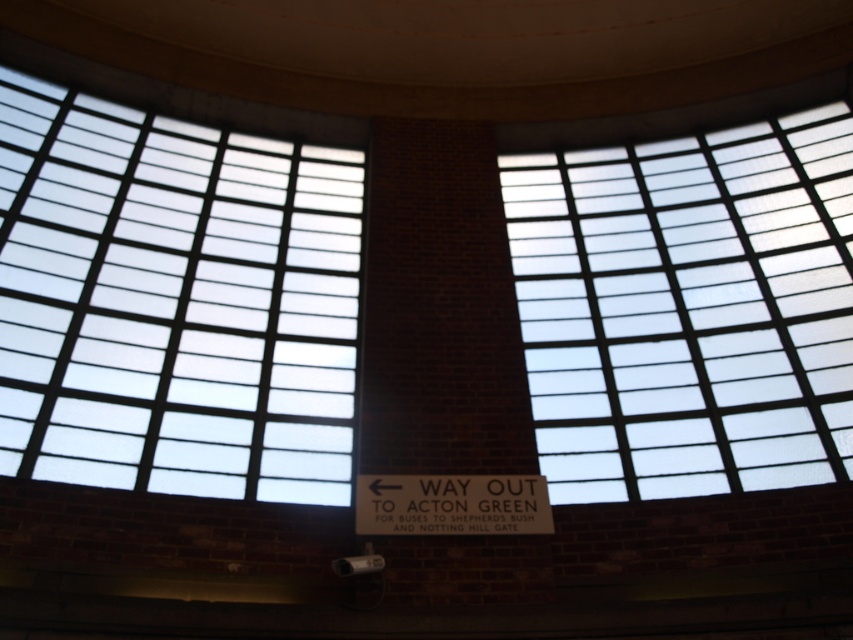
Which of these two, clear glass window at upper left or clear glass window at upper right, stands taller?

Standing taller between the two is clear glass window at upper left.

Is clear glass window at upper left wider than clear glass window at upper right?

Correct, the width of clear glass window at upper left exceeds that of clear glass window at upper right.

Is point (196, 371) closer to viewer compared to point (755, 200)?

That is True.

Identify the location of clear glass window at upper left. The width and height of the screenshot is (853, 640). [x=173, y=301].

Who is positioned more to the left, clear glass window at upper right or white matte sign at center?

From the viewer's perspective, white matte sign at center appears more on the left side.

Is point (761, 176) farther from viewer compared to point (430, 481)?

That is True.

Find the location of a particular element. clear glass window at upper right is located at coordinates (688, 308).

Is clear glass window at upper left thinner than white matte sign at center?

No.

Between clear glass window at upper left and white matte sign at center, which one has more height?

Standing taller between the two is clear glass window at upper left.

Is point (322, 340) less distant than point (492, 508)?

No, (322, 340) is behind (492, 508).

Locate an element on the screen. The image size is (853, 640). clear glass window at upper left is located at coordinates (173, 301).